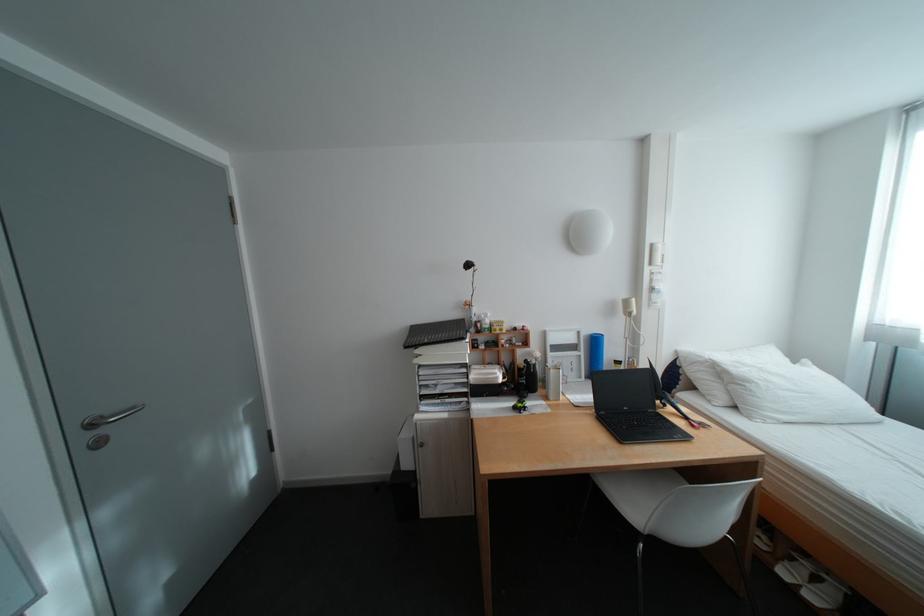
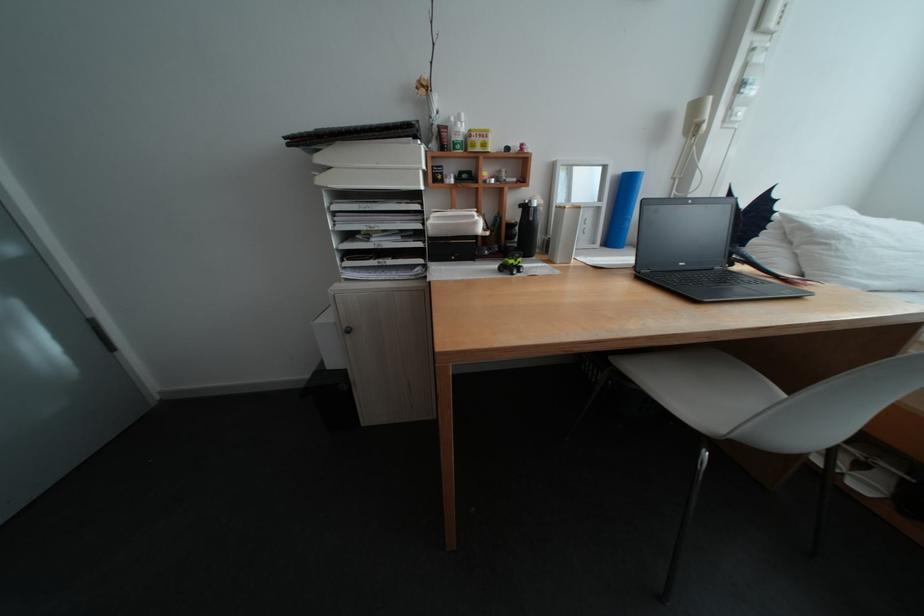
Question: In a continuous first-person perspective shot, in which direction is the camera moving?

Choices:
 (A) Left
 (B) Right
 (C) Forward
 (D) Backward

Answer: (C)